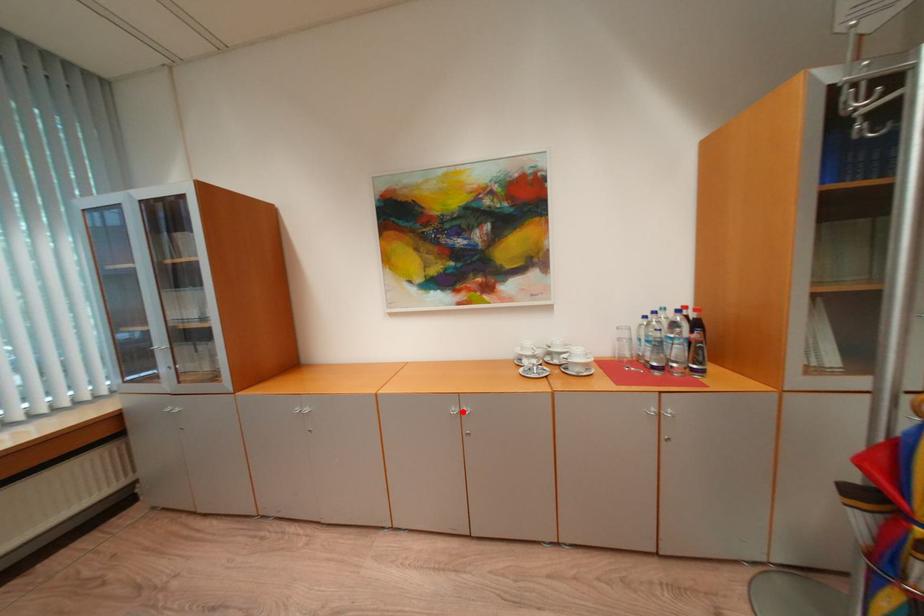
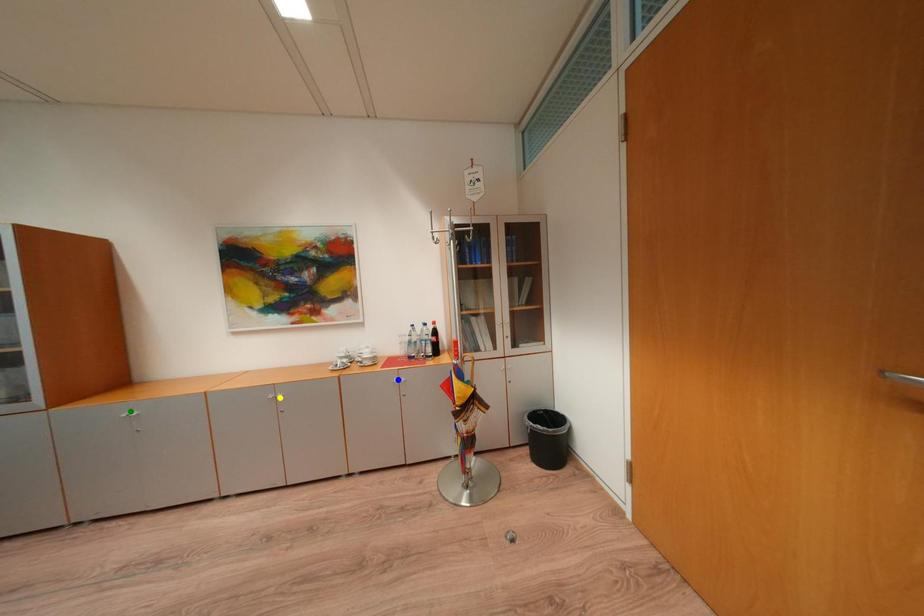
Question: I am providing you with two images of the same scene from different viewpoints. A red point is marked on the first image. You are given multiple points on the second image. Can you choose the point in image 2 that corresponds to the point in image 1?

Choices:
 (A) yellow point
 (B) green point
 (C) blue point

Answer: (A)